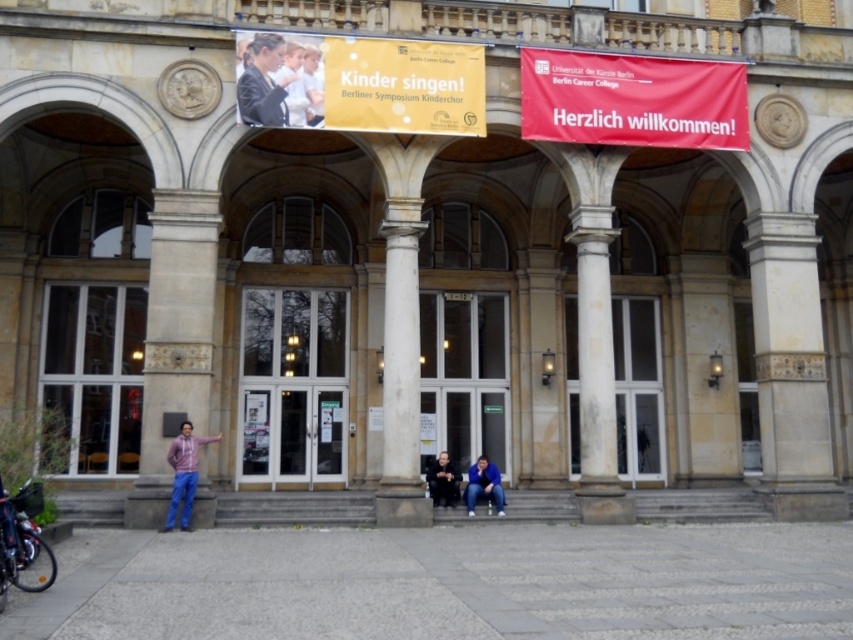
Question: Which point is closer to the camera?

Choices:
 (A) dark blue jeans at center
 (B) white marble column at center
 (C) matte pink hoodie at center

Answer: (C)

Question: Among these points, which one is farthest from the camera?

Choices:
 (A) (164, 308)
 (B) (416, 429)

Answer: (B)

Question: Among these points, which one is nearest to the camera?

Choices:
 (A) (410, 387)
 (B) (189, 371)
 (C) (318, 84)
 (D) (169, 502)

Answer: (D)

Question: Where is shiny metallic motorcycle at lower left located in relation to matte pink hoodie at center in the image?

Choices:
 (A) left
 (B) right

Answer: (A)

Question: Is matte pink hoodie at center smaller than dark blue jeans at center?

Choices:
 (A) no
 (B) yes

Answer: (A)

Question: Is beige stone column at left positioned at the back of dark blue jeans at center?

Choices:
 (A) no
 (B) yes

Answer: (A)